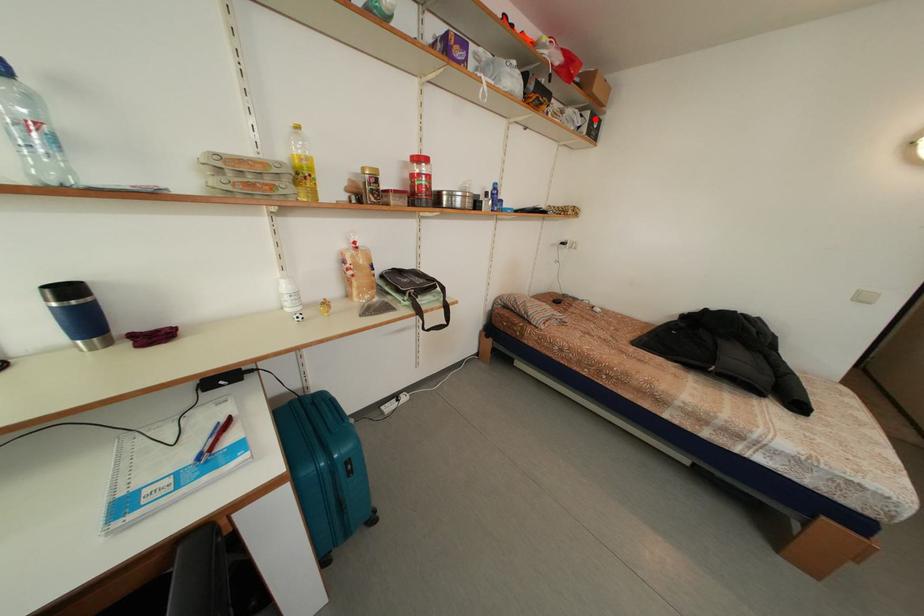
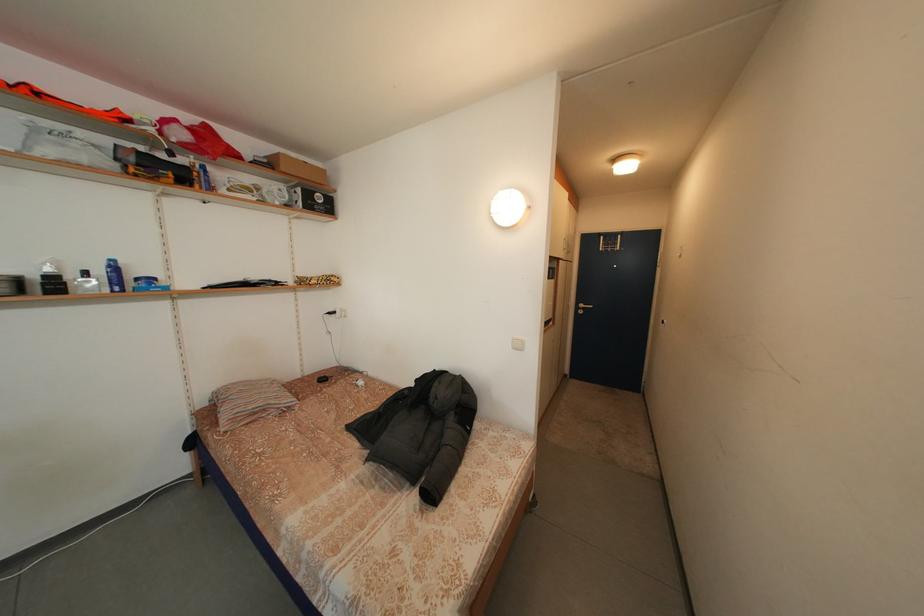
In the second image, find the point that corresponds to the highlighted location in the first image.

(307, 196)